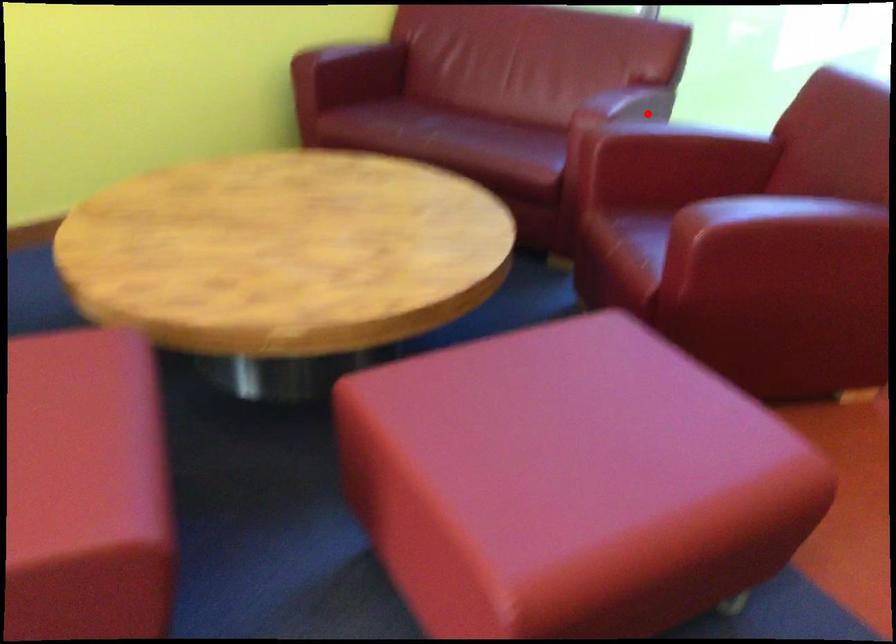
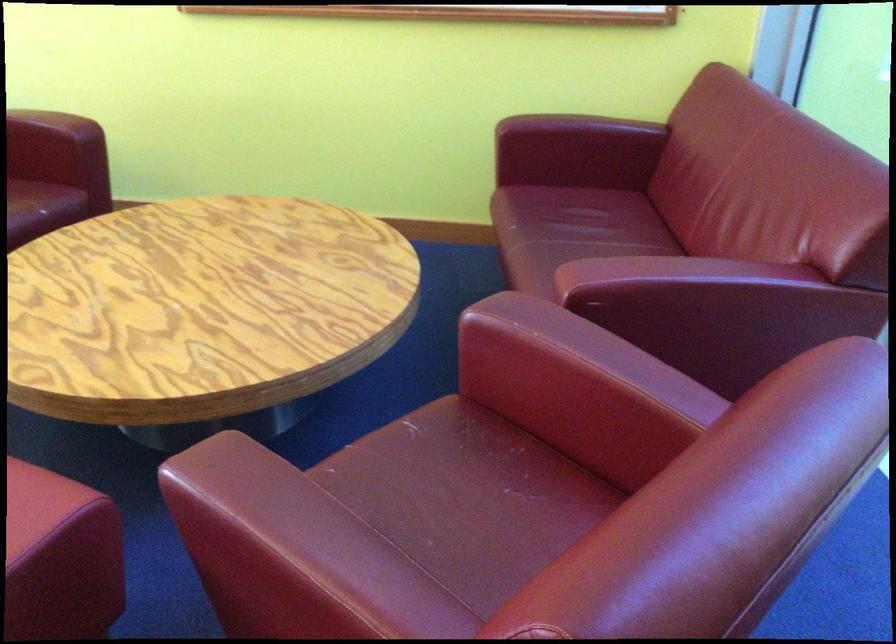
Find the pixel in the second image that matches the highlighted location in the first image.

(787, 323)